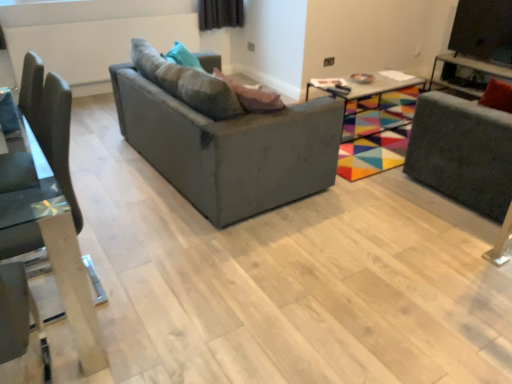
You are a GUI agent. You are given a task and a screenshot of the screen. Output one action in this format:
    pyautogui.click(x=<x>, y=<y>)
    Task: Click on the black glossy tv at upper right
    This screenshot has height=384, width=512.
    Given the screenshot: What is the action you would take?
    pyautogui.click(x=483, y=30)

How much space does multicolored fabric table at center, marked as the 1th table in a left-to-right arrangement, occupy vertically?

17.26 inches.

The height and width of the screenshot is (384, 512). Describe the element at coordinates (50, 207) in the screenshot. I see `transparent glass chair at left` at that location.

This screenshot has width=512, height=384. I want to click on metallic silver tv stand at upper right, the 2th table positioned from the left, so (465, 77).

The image size is (512, 384). In order to click on matte gray couch at center in this screenshot , I will do `click(224, 137)`.

Is matte gray couch at center inside the boundaries of metallic silver tv stand at upper right, the 2th table positioned from the left, or outside?

matte gray couch at center is outside metallic silver tv stand at upper right, the 2th table positioned from the left.

Is matte gray couch at center not close to metallic silver tv stand at upper right, the 2th table positioned from the left?

Yes, matte gray couch at center and metallic silver tv stand at upper right, the 2th table positioned from the left, are located far from each other.

Considering the positions of point (123, 89) and point (451, 81), is point (123, 89) closer or farther from the camera than point (451, 81)?

Point (123, 89).

Who is smaller, matte gray couch at center or metallic silver tv stand at upper right, which is the first table in right-to-left order?

metallic silver tv stand at upper right, which is the first table in right-to-left order.

Is point (441, 169) closer or farther from the camera than point (506, 28)?

Point (441, 169) is positioned closer to the camera compared to point (506, 28).

Where is `swivel chair to the left of black glossy tv at upper right`? swivel chair to the left of black glossy tv at upper right is located at coordinates (462, 152).

Considering the positions of objects velvet grey swivel chair at right and black glossy tv at upper right in the image provided, who is behind, velvet grey swivel chair at right or black glossy tv at upper right?

black glossy tv at upper right is behind.

From the image's perspective, is velvet grey swivel chair at right positioned above or below black glossy tv at upper right?

From the image's perspective, velvet grey swivel chair at right appears below black glossy tv at upper right.

Which is in front, metallic silver tv stand at upper right, which is the first table in right-to-left order, or matte gray couch at center?

matte gray couch at center is closer to the camera.

From a real-world perspective, which object rests below the other?

metallic silver tv stand at upper right, which is the first table in right-to-left order.

Is metallic silver tv stand at upper right, which is the first table in right-to-left order, far from matte gray couch at center?

Yes, metallic silver tv stand at upper right, which is the first table in right-to-left order, is far from matte gray couch at center.

Is metallic silver tv stand at upper right, which is the first table in right-to-left order, positioned with its back to matte gray couch at center?

No, metallic silver tv stand at upper right, which is the first table in right-to-left order, is not facing the opposite direction of matte gray couch at center.

How distant is black glossy tv at upper right from transparent glass chair at left?

The distance of black glossy tv at upper right from transparent glass chair at left is 17.27 feet.

From the image's perspective, is black glossy tv at upper right above transparent glass chair at left?

Yes, from the image's perspective, black glossy tv at upper right is on top of transparent glass chair at left.

Which of these two, black glossy tv at upper right or transparent glass chair at left, stands shorter?

black glossy tv at upper right.

The image size is (512, 384). I want to click on chair in front of the black glossy tv at upper right, so click(x=50, y=207).

From a real-world perspective, is velvet grey swivel chair at right positioned above or below transparent glass chair at left?

From a real-world perspective, velvet grey swivel chair at right is physically above transparent glass chair at left.

Is velvet grey swivel chair at right facing towards transparent glass chair at left?

No.

Considering the positions of objects velvet grey swivel chair at right and transparent glass chair at left in the image provided, who is behind, velvet grey swivel chair at right or transparent glass chair at left?

velvet grey swivel chair at right.

In the scene shown: From the image's perspective, which is below, velvet grey swivel chair at right or transparent glass chair at left?

From the image's view, transparent glass chair at left is below.

From a real-world perspective, is metallic silver tv stand at upper right, the 2th table positioned from the left, over black glossy tv at upper right?

No, from a real-world perspective, metallic silver tv stand at upper right, the 2th table positioned from the left, is not above black glossy tv at upper right.

Can you see metallic silver tv stand at upper right, which is the first table in right-to-left order, touching black glossy tv at upper right?

No, metallic silver tv stand at upper right, which is the first table in right-to-left order, is not next to black glossy tv at upper right.

Which is farther, (496, 71) or (490, 47)?

Point (490, 47)

From the image's perspective, is metallic silver tv stand at upper right, the 2th table positioned from the left, positioned above or below black glossy tv at upper right?

Based on their image positions, metallic silver tv stand at upper right, the 2th table positioned from the left, is located beneath black glossy tv at upper right.

Considering the points (460, 35) and (470, 81), which point is in front, point (460, 35) or point (470, 81)?

The point (470, 81) is in front.

Where is `table that is behind the black glossy tv at upper right`? This screenshot has height=384, width=512. table that is behind the black glossy tv at upper right is located at coordinates (465, 77).

From a real-world perspective, who is located higher, black glossy tv at upper right or metallic silver tv stand at upper right, the 2th table positioned from the left?

black glossy tv at upper right is physically above.

Looking at their sizes, would you say black glossy tv at upper right is wider or thinner than metallic silver tv stand at upper right, the 2th table positioned from the left?

In the image, black glossy tv at upper right appears to be more narrow than metallic silver tv stand at upper right, the 2th table positioned from the left.

From the image's perspective, count 2nd tables upward from the matte gray couch at center and point to it. Please provide its 2D coordinates.

[(465, 77)]

The width and height of the screenshot is (512, 384). What are the coordinates of `swivel chair that appears below the black glossy tv at upper right (from the image's perspective)` in the screenshot? It's located at (462, 152).

From the image, which object appears to be farther from velvet grey swivel chair at right, matte gray couch at center or transparent glass chair at left?

Among the two, transparent glass chair at left is located further to velvet grey swivel chair at right.

From the picture: When comparing their distances from multicolored fabric table at center, placed as the second table when sorted from right to left, does transparent glass chair at left or metallic silver tv stand at upper right, the 2th table positioned from the left, seem closer?

metallic silver tv stand at upper right, the 2th table positioned from the left.

Which object lies further to the anchor point black glossy tv at upper right, transparent glass chair at left or matte gray couch at center?

Based on the image, transparent glass chair at left appears to be further to black glossy tv at upper right.

Which object lies nearer to the anchor point velvet grey swivel chair at right, multicolored fabric table at center, placed as the second table when sorted from right to left, or black glossy tv at upper right?

multicolored fabric table at center, placed as the second table when sorted from right to left, is closer to velvet grey swivel chair at right.

Looking at the image, which one is located closer to matte gray couch at center, transparent glass chair at left or multicolored fabric table at center, placed as the second table when sorted from right to left?

Based on the image, transparent glass chair at left appears to be nearer to matte gray couch at center.

Based on their spatial positions, is velvet grey swivel chair at right or metallic silver tv stand at upper right, the 2th table positioned from the left, closer to matte gray couch at center?

velvet grey swivel chair at right lies closer to matte gray couch at center than the other object.

When comparing their distances from velvet grey swivel chair at right, does black glossy tv at upper right or transparent glass chair at left seem closer?

transparent glass chair at left is positioned closer to the anchor velvet grey swivel chair at right.

Considering their positions, is metallic silver tv stand at upper right, which is the first table in right-to-left order, positioned further to transparent glass chair at left than velvet grey swivel chair at right?

metallic silver tv stand at upper right, which is the first table in right-to-left order, is further to transparent glass chair at left.

I want to click on swivel chair situated between transparent glass chair at left and metallic silver tv stand at upper right, the 2th table positioned from the left, from left to right, so click(x=462, y=152).

The image size is (512, 384). I want to click on table between velvet grey swivel chair at right and black glossy tv at upper right from front to back, so click(374, 103).

Locate an element on the screen. Image resolution: width=512 pixels, height=384 pixels. studio couch between transparent glass chair at left and multicolored fabric table at center, marked as the 1th table in a left-to-right arrangement, in the front-back direction is located at coordinates (224, 137).

The image size is (512, 384). Find the location of `table between transparent glass chair at left and velvet grey swivel chair at right from left to right`. table between transparent glass chair at left and velvet grey swivel chair at right from left to right is located at coordinates (374, 103).